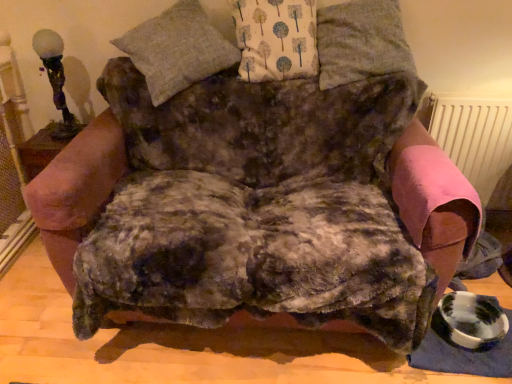
Question: Is matte glass table lamp at upper left outside of gray woolen pillow at upper center, which is the 3th pillow in right-to-left order?

Choices:
 (A) no
 (B) yes

Answer: (B)

Question: Considering the relative positions of matte glass table lamp at upper left and gray woolen pillow at upper center, which is the 3th pillow in right-to-left order, in the image provided, is matte glass table lamp at upper left in front of gray woolen pillow at upper center, which is the 3th pillow in right-to-left order,?

Choices:
 (A) yes
 (B) no

Answer: (B)

Question: From a real-world perspective, is matte glass table lamp at upper left located higher than gray woolen pillow at upper center, which appears as the first pillow when viewed from the left?

Choices:
 (A) no
 (B) yes

Answer: (A)

Question: Is gray woolen pillow at upper center, which appears as the first pillow when viewed from the left, at the back of matte glass table lamp at upper left?

Choices:
 (A) yes
 (B) no

Answer: (B)

Question: Is matte glass table lamp at upper left at the right side of gray woolen pillow at upper center, which appears as the first pillow when viewed from the left?

Choices:
 (A) no
 (B) yes

Answer: (A)

Question: Is gray woolen pillow at upper center, which is the 3th pillow in right-to-left order, in front of or behind pink fabric radiator at right in the image?

Choices:
 (A) front
 (B) behind

Answer: (A)

Question: From the image's perspective, is gray woolen pillow at upper center, which is the 3th pillow in right-to-left order, above or below pink fabric radiator at right?

Choices:
 (A) below
 (B) above

Answer: (B)

Question: Is point (163, 77) closer or farther from the camera than point (472, 172)?

Choices:
 (A) closer
 (B) farther

Answer: (A)

Question: In terms of height, does gray woolen pillow at upper center, which appears as the first pillow when viewed from the left, look taller or shorter compared to pink fabric radiator at right?

Choices:
 (A) short
 (B) tall

Answer: (A)

Question: From the image's perspective, is gray fabric pillow at upper center, which is the 3th pillow in left-to-right order, above or below white fabric with tree pattern at upper center, which is the 2th pillow in right-to-left order?

Choices:
 (A) below
 (B) above

Answer: (A)

Question: Is gray fabric pillow at upper center, which is the 3th pillow in left-to-right order, spatially inside white fabric with tree pattern at upper center, the 2th pillow viewed from the left, or outside of it?

Choices:
 (A) inside
 (B) outside

Answer: (B)

Question: From a real-world perspective, relative to white fabric with tree pattern at upper center, the 2th pillow viewed from the left, is gray fabric pillow at upper center, the first pillow in the right-to-left sequence, vertically above or below?

Choices:
 (A) above
 (B) below

Answer: (A)

Question: Is gray fabric pillow at upper center, which is the 3th pillow in left-to-right order, bigger or smaller than white fabric with tree pattern at upper center, the 2th pillow viewed from the left?

Choices:
 (A) big
 (B) small

Answer: (A)

Question: Is point (259, 64) closer or farther from the camera than point (42, 59)?

Choices:
 (A) closer
 (B) farther

Answer: (A)

Question: In the image, is white fabric with tree pattern at upper center, which is the 2th pillow in right-to-left order, on the left side or the right side of matte glass table lamp at upper left?

Choices:
 (A) right
 (B) left

Answer: (A)